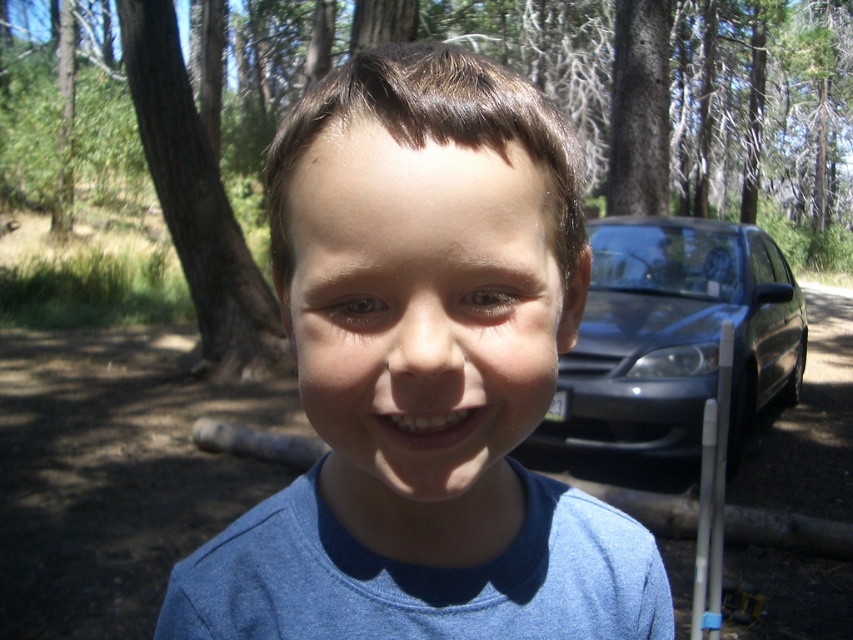
Does satin blue sedan at right appear over brown rough tree at left?

Incorrect, satin blue sedan at right is not positioned above brown rough tree at left.

Between satin blue sedan at right and brown rough tree at left, which one is positioned lower?

satin blue sedan at right is below.

Which is behind, point (790, 310) or point (256, 273)?

Positioned behind is point (256, 273).

The image size is (853, 640). Find the location of `satin blue sedan at right`. satin blue sedan at right is located at coordinates (676, 337).

Between blue cotton shirt at center and satin blue sedan at right, which one has less height?

With less height is blue cotton shirt at center.

Is blue cotton shirt at center to the right of satin blue sedan at right from the viewer's perspective?

No, blue cotton shirt at center is not to the right of satin blue sedan at right.

Where is `blue cotton shirt at center`? This screenshot has height=640, width=853. blue cotton shirt at center is located at coordinates (424, 378).

You are a GUI agent. You are given a task and a screenshot of the screen. Output one action in this format:
    pyautogui.click(x=<x>, y=<y>)
    Task: Click on the blue cotton shirt at center
    The width and height of the screenshot is (853, 640).
    Given the screenshot: What is the action you would take?
    pyautogui.click(x=424, y=378)

Is blue cotton shirt at center to the left of brown rough tree at left from the viewer's perspective?

In fact, blue cotton shirt at center is to the right of brown rough tree at left.

Is point (561, 628) closer to viewer compared to point (163, 6)?

Yes, point (561, 628) is closer to viewer.

At what (x,y) coordinates should I click in order to perform the action: click on blue cotton shirt at center. Please return your answer as a coordinate pair (x, y). The image size is (853, 640). Looking at the image, I should click on (424, 378).